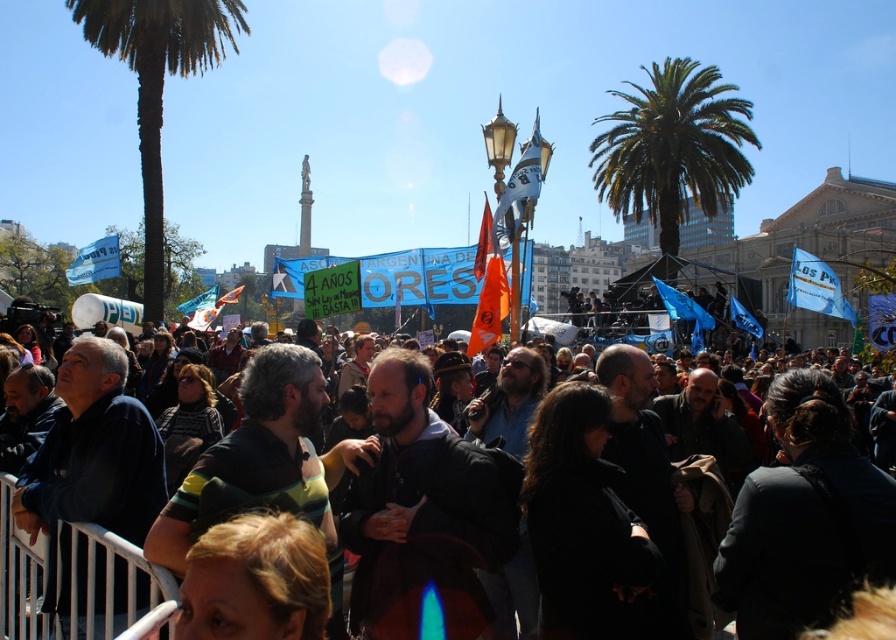
From the picture: Which of these two, green leafy palm tree at upper right or dark clothing crowd at center, stands shorter?

dark clothing crowd at center is shorter.

This screenshot has height=640, width=896. What are the coordinates of `green leafy palm tree at upper right` in the screenshot? It's located at (673, 148).

Can you confirm if green leafy palm tree at left is smaller than dark clothing crowd at center?

Yes, green leafy palm tree at left is smaller than dark clothing crowd at center.

Who is shorter, green leafy palm tree at left or dark clothing crowd at center?

dark clothing crowd at center is shorter.

Who is more distant from viewer, (x=139, y=33) or (x=0, y=474)?

The point (x=139, y=33) is behind.

The image size is (896, 640). In order to click on green leafy palm tree at left in this screenshot , I will do `click(158, 83)`.

Does green leafy palm tree at upper right appear on the right side of green leafy palm tree at left?

Indeed, green leafy palm tree at upper right is positioned on the right side of green leafy palm tree at left.

Does green leafy palm tree at upper right appear on the left side of green leafy palm tree at left?

In fact, green leafy palm tree at upper right is to the right of green leafy palm tree at left.

Where is `green leafy palm tree at upper right`? This screenshot has width=896, height=640. green leafy palm tree at upper right is located at coordinates (673, 148).